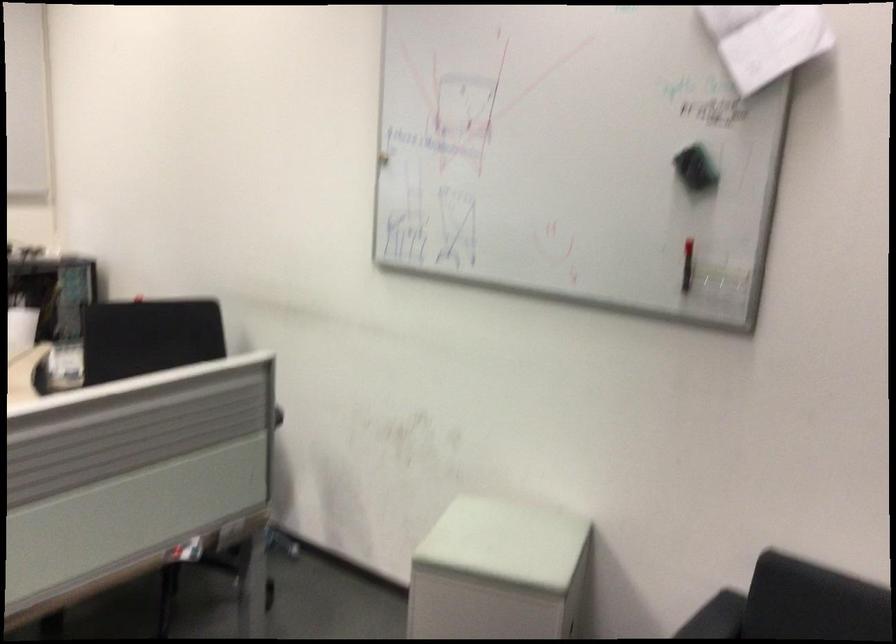
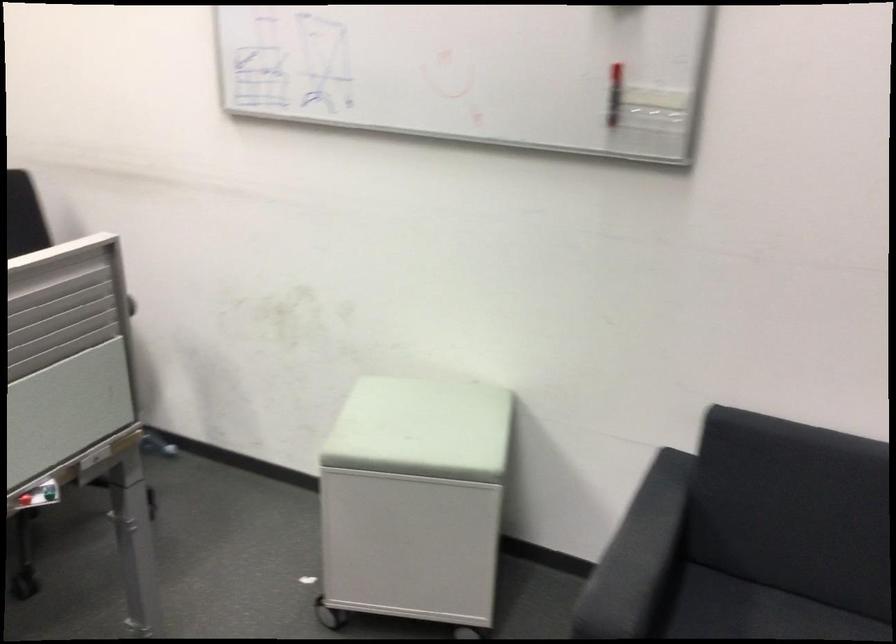
Question: The first image is from the beginning of the video and the second image is from the end. How did the camera likely rotate when shooting the video?

Choices:
 (A) Left
 (B) Right
 (C) Up
 (D) Down

Answer: (D)